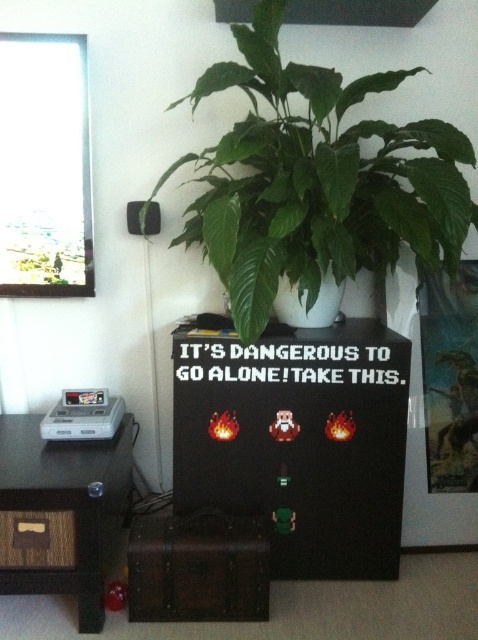
Question: Considering the relative positions of brushed wood table at left and metallic silver poster at right in the image provided, where is brushed wood table at left located with respect to metallic silver poster at right?

Choices:
 (A) above
 (B) below

Answer: (B)

Question: Based on their relative distances, which object is farther from the green leafy plant at upper center?

Choices:
 (A) brushed wood table at left
 (B) black matte speaker at upper left
 (C) metallic silver poster at right

Answer: (A)

Question: Which of the following is the closest to the observer?

Choices:
 (A) (238, 180)
 (B) (126, 214)

Answer: (A)

Question: Can you confirm if brushed wood table at left is positioned below metallic silver poster at right?

Choices:
 (A) yes
 (B) no

Answer: (A)

Question: Which point appears closest to the camera in this image?

Choices:
 (A) pos(155,220)
 (B) pos(394,260)

Answer: (B)

Question: Is white plastic game console at left bigger than black matte speaker at upper left?

Choices:
 (A) no
 (B) yes

Answer: (B)